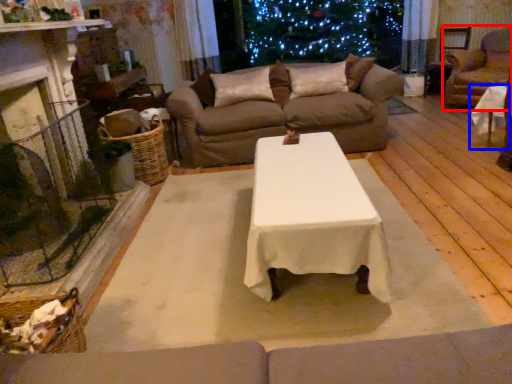
Question: Which object appears farthest to the camera in this image, armchair (highlighted by a red box) or table (highlighted by a blue box)?

Choices:
 (A) armchair
 (B) table

Answer: (A)